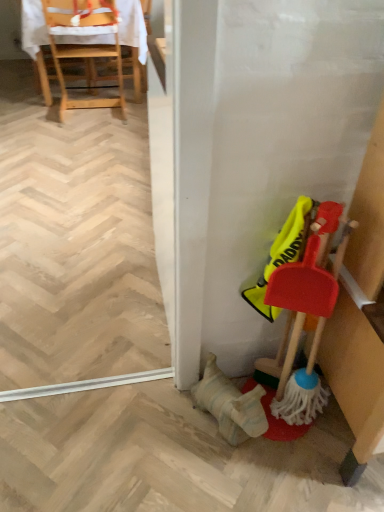
This screenshot has height=512, width=384. Describe the element at coordinates (84, 45) in the screenshot. I see `wooden chair at upper left` at that location.

Where is `wooden chair at upper left`? The height and width of the screenshot is (512, 384). wooden chair at upper left is located at coordinates (84, 45).

This screenshot has width=384, height=512. I want to click on wooden chair at upper left, so click(x=84, y=45).